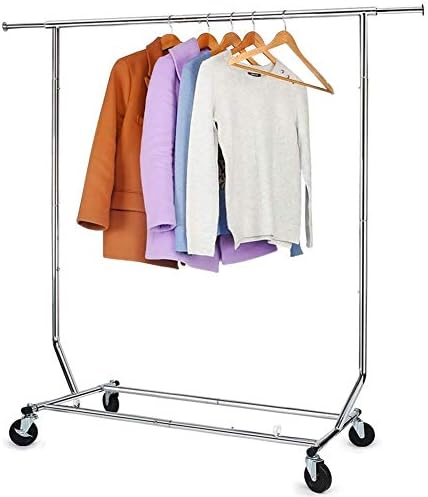
What are the coordinates of `hangers` in the screenshot? It's located at (287, 40), (253, 34), (228, 32), (202, 38), (162, 43).